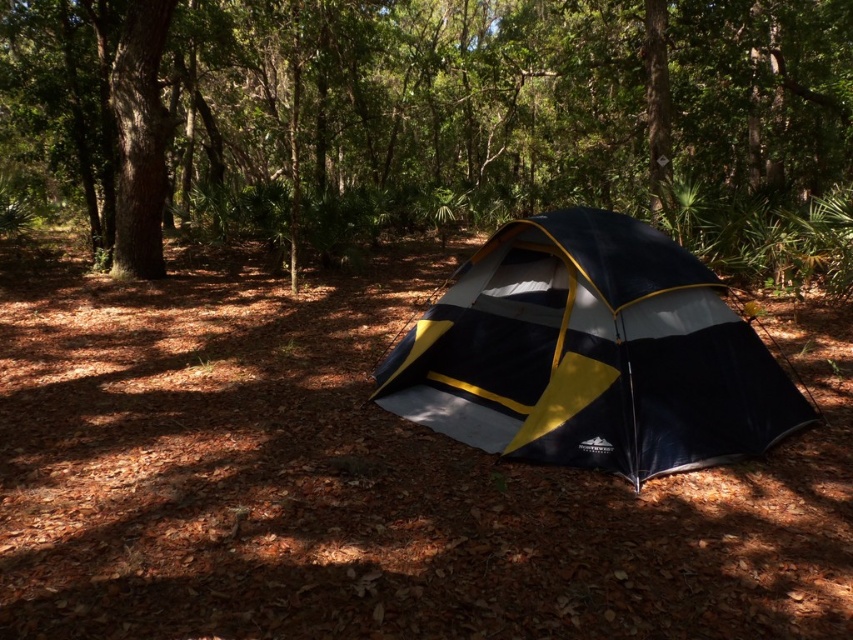
Question: Is the position of green leafy tree at center more distant than that of blue/yellow fabric tent at center?

Choices:
 (A) yes
 (B) no

Answer: (A)

Question: Which of the following is the closest to the observer?

Choices:
 (A) (488, 301)
 (B) (801, 58)

Answer: (A)

Question: Which of the following is the farthest from the observer?

Choices:
 (A) (630, 275)
 (B) (332, 100)

Answer: (B)

Question: Which of the following is the farthest from the observer?

Choices:
 (A) blue/yellow fabric tent at center
 (B) green leafy tree at center

Answer: (B)

Question: Is green leafy tree at center positioned before blue/yellow fabric tent at center?

Choices:
 (A) yes
 (B) no

Answer: (B)

Question: Does green leafy tree at center have a greater width compared to blue/yellow fabric tent at center?

Choices:
 (A) yes
 (B) no

Answer: (A)